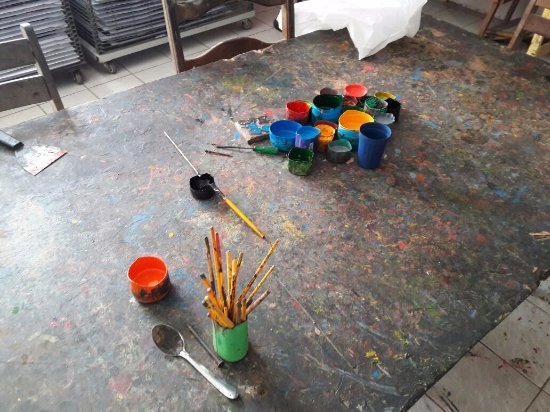
The height and width of the screenshot is (412, 550). I want to click on table with paint platter everywhere, so click(x=323, y=224).